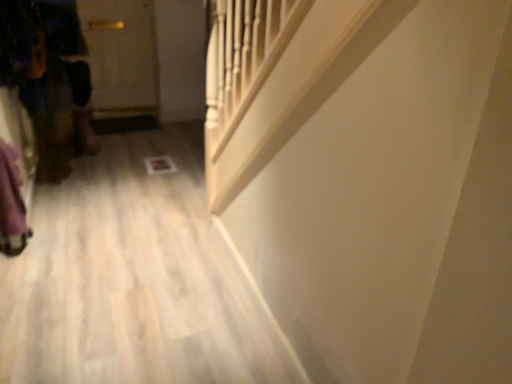
The image size is (512, 384). What do you see at coordinates (121, 54) in the screenshot?
I see `matte wood door at upper left` at bounding box center [121, 54].

Locate an element on the screen. This screenshot has width=512, height=384. matte wood door at upper left is located at coordinates (121, 54).

What is the approximate width of matte wood door at upper left?

It is 1.32 inches.

I want to click on matte wood door at upper left, so click(x=121, y=54).